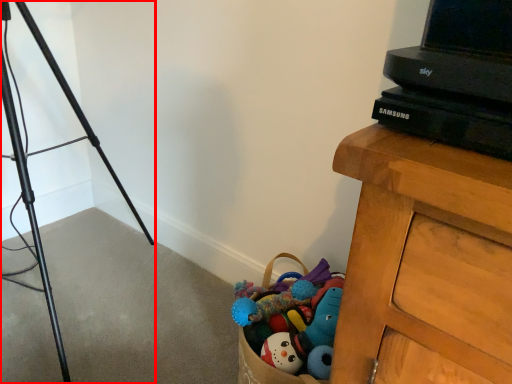
Question: In this image, where is tripod (annotated by the red box) located relative to computer?

Choices:
 (A) left
 (B) right

Answer: (A)